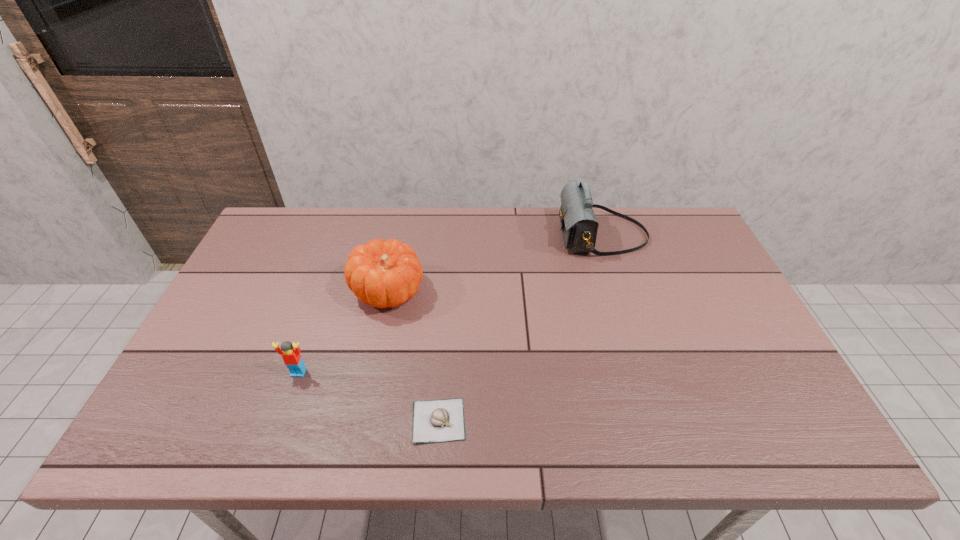
At what (x,y) coordinates should I click in order to perform the action: click on object that is the second closest one to the third object from right to left. Please return your answer as a coordinate pair (x, y). The image size is (960, 540). Looking at the image, I should click on (442, 420).

Identify the location of free space that satisfies the following two spatial constraints: 1. on the back side of the tallest object; 2. on the right side of the second object from right to left. (452, 235).

Where is `free space that satisfies the following two spatial constraints: 1. on the back side of the second tallest object; 2. on the left side of the farthest object`? The width and height of the screenshot is (960, 540). free space that satisfies the following two spatial constraints: 1. on the back side of the second tallest object; 2. on the left side of the farthest object is located at coordinates (400, 235).